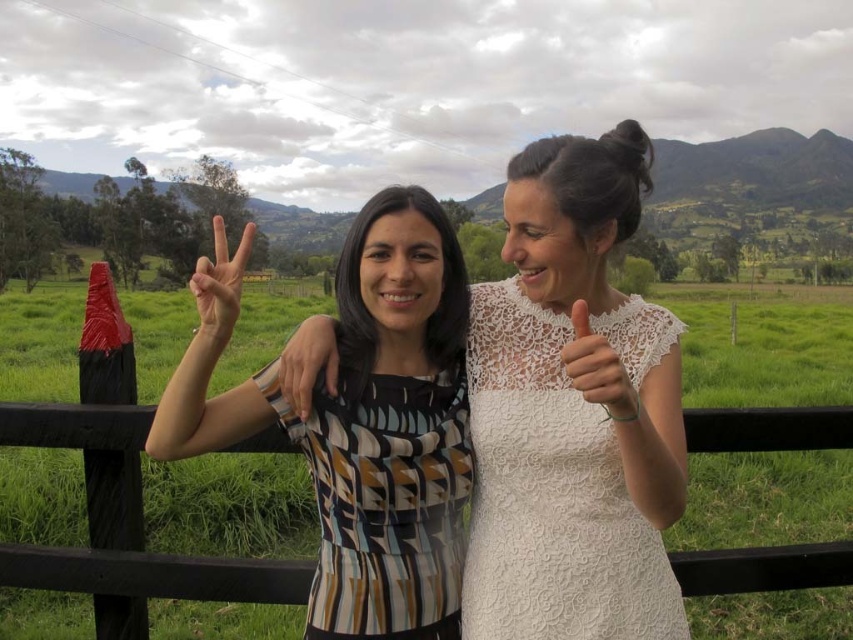
Can you confirm if white lace hand at center is positioned to the right of matte black dress at center?

Yes, white lace hand at center is to the right of matte black dress at center.

Who is higher up, white lace hand at center or matte black dress at center?

Positioned higher is matte black dress at center.

Describe the element at coordinates (596, 368) in the screenshot. This screenshot has width=853, height=640. I see `white lace hand at center` at that location.

This screenshot has width=853, height=640. What are the coordinates of `white lace hand at center` in the screenshot? It's located at (596, 368).

Does point (229, 433) come behind point (316, 337)?

Yes, it is.

Measure the distance between patterned fabric dress at center and matte black dress at center.

patterned fabric dress at center and matte black dress at center are 9.98 inches apart.

Locate an element on the screen. This screenshot has height=640, width=853. patterned fabric dress at center is located at coordinates (358, 419).

Find the location of a particular element. The image size is (853, 640). patterned fabric dress at center is located at coordinates (358, 419).

Does matte black hand at center lie in front of matte black dress at center?

Yes, matte black hand at center is closer to the viewer.

You are a GUI agent. You are given a task and a screenshot of the screen. Output one action in this format:
    pyautogui.click(x=<x>, y=<y>)
    Task: Click on the matte black hand at center
    This screenshot has width=853, height=640.
    Given the screenshot: What is the action you would take?
    pyautogui.click(x=219, y=285)

Image resolution: width=853 pixels, height=640 pixels. I want to click on matte black hand at center, so click(x=219, y=285).